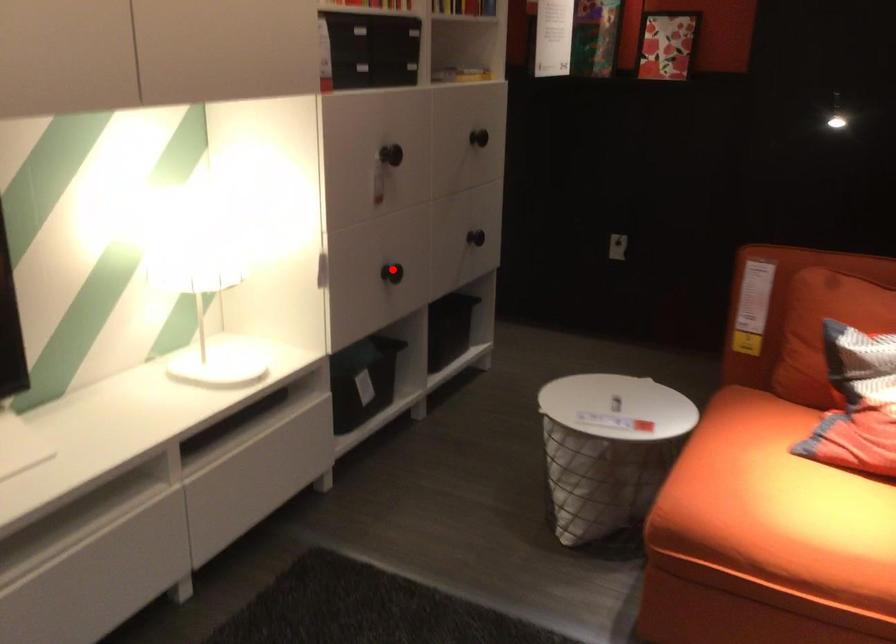
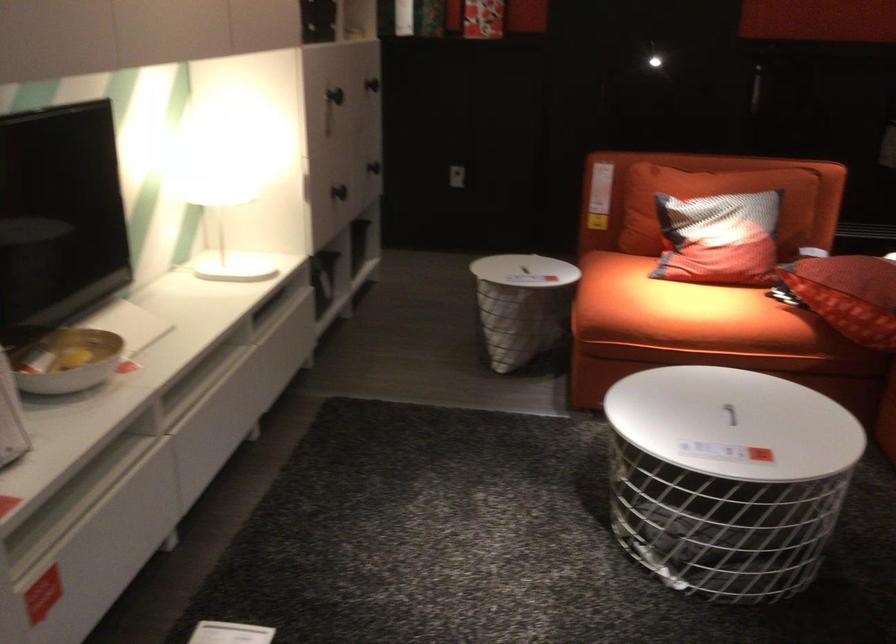
Question: I am providing you with two images of the same scene from different viewpoints. Image1 has a red point marked. In image2, the corresponding 3D location appears at what relative position? Reply with the corresponding letter.

Choices:
 (A) Closer
 (B) Farther

Answer: (B)